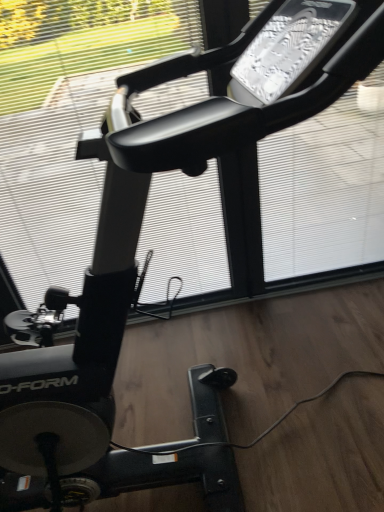
How much space does transparent plastic window screen at upper center, placed as the 1th window screen when sorted from right to left, occupy horizontally?

3.71 inches.

The image size is (384, 512). I want to click on transparent plastic window screen at upper center, which is the second window screen in left-to-right order, so click(x=325, y=187).

The width and height of the screenshot is (384, 512). What do you see at coordinates (325, 187) in the screenshot? I see `transparent plastic window screen at upper center, which is the second window screen in left-to-right order` at bounding box center [325, 187].

The height and width of the screenshot is (512, 384). What do you see at coordinates (66, 138) in the screenshot? I see `white matte window screen at center, acting as the second window screen starting from the right` at bounding box center [66, 138].

The width and height of the screenshot is (384, 512). Find the location of `white matte window screen at center, which ranks as the first window screen in left-to-right order`. white matte window screen at center, which ranks as the first window screen in left-to-right order is located at coordinates (66, 138).

This screenshot has height=512, width=384. What are the coordinates of `transparent plastic window screen at upper center, which is the second window screen in left-to-right order` in the screenshot? It's located at (325, 187).

Can you confirm if transparent plastic window screen at upper center, which is the second window screen in left-to-right order, is positioned to the left of white matte window screen at center, which ranks as the first window screen in left-to-right order?

No.

Does transparent plastic window screen at upper center, placed as the 1th window screen when sorted from right to left, lie behind white matte window screen at center, acting as the second window screen starting from the right?

Yes, transparent plastic window screen at upper center, placed as the 1th window screen when sorted from right to left, is further from the viewer.

Between point (303, 263) and point (61, 226), which one is positioned behind?

The point (303, 263) is farther.

From the image's perspective, is transparent plastic window screen at upper center, which is the second window screen in left-to-right order, beneath white matte window screen at center, acting as the second window screen starting from the right?

No, from the image's perspective, transparent plastic window screen at upper center, which is the second window screen in left-to-right order, is not below white matte window screen at center, acting as the second window screen starting from the right.

From a real-world perspective, is transparent plastic window screen at upper center, which is the second window screen in left-to-right order, physically located above or below white matte window screen at center, acting as the second window screen starting from the right?

From a real-world perspective, transparent plastic window screen at upper center, which is the second window screen in left-to-right order, is physically below white matte window screen at center, acting as the second window screen starting from the right.

Which object is thinner, transparent plastic window screen at upper center, placed as the 1th window screen when sorted from right to left, or white matte window screen at center, which ranks as the first window screen in left-to-right order?

With smaller width is white matte window screen at center, which ranks as the first window screen in left-to-right order.

From their relative heights in the image, would you say transparent plastic window screen at upper center, placed as the 1th window screen when sorted from right to left, is taller or shorter than white matte window screen at center, which ranks as the first window screen in left-to-right order?

transparent plastic window screen at upper center, placed as the 1th window screen when sorted from right to left, is shorter than white matte window screen at center, which ranks as the first window screen in left-to-right order.

Does transparent plastic window screen at upper center, placed as the 1th window screen when sorted from right to left, have a larger size compared to white matte window screen at center, acting as the second window screen starting from the right?

No.

Is transparent plastic window screen at upper center, which is the second window screen in left-to-right order, spatially inside white matte window screen at center, acting as the second window screen starting from the right, or outside of it?

transparent plastic window screen at upper center, which is the second window screen in left-to-right order, cannot be found inside white matte window screen at center, acting as the second window screen starting from the right.

Does transparent plastic window screen at upper center, which is the second window screen in left-to-right order, touch white matte window screen at center, which ranks as the first window screen in left-to-right order?

No, transparent plastic window screen at upper center, which is the second window screen in left-to-right order, is not next to white matte window screen at center, which ranks as the first window screen in left-to-right order.

Could you tell me if transparent plastic window screen at upper center, placed as the 1th window screen when sorted from right to left, is facing white matte window screen at center, acting as the second window screen starting from the right?

No, transparent plastic window screen at upper center, placed as the 1th window screen when sorted from right to left, does not turn towards white matte window screen at center, acting as the second window screen starting from the right.

What's the angular difference between transparent plastic window screen at upper center, placed as the 1th window screen when sorted from right to left, and white matte window screen at center, which ranks as the first window screen in left-to-right order,'s facing directions?

The angle between the facing direction of transparent plastic window screen at upper center, placed as the 1th window screen when sorted from right to left, and the facing direction of white matte window screen at center, which ranks as the first window screen in left-to-right order, is 0.00185 degrees.

Locate an element on the screen. The image size is (384, 512). window screen in front of the transparent plastic window screen at upper center, placed as the 1th window screen when sorted from right to left is located at coordinates (66, 138).

Is white matte window screen at center, acting as the second window screen starting from the right, at the right side of transparent plastic window screen at upper center, which is the second window screen in left-to-right order?

No.

Considering the relative positions of white matte window screen at center, which ranks as the first window screen in left-to-right order, and transparent plastic window screen at upper center, placed as the 1th window screen when sorted from right to left, in the image provided, is white matte window screen at center, which ranks as the first window screen in left-to-right order, in front of transparent plastic window screen at upper center, placed as the 1th window screen when sorted from right to left,?

Yes, white matte window screen at center, which ranks as the first window screen in left-to-right order, is in front of transparent plastic window screen at upper center, placed as the 1th window screen when sorted from right to left.

Is point (121, 59) more distant than point (375, 223)?

Yes, it is behind point (375, 223).

From the image's perspective, is white matte window screen at center, acting as the second window screen starting from the right, on transparent plastic window screen at upper center, placed as the 1th window screen when sorted from right to left?

Actually, white matte window screen at center, acting as the second window screen starting from the right, appears below transparent plastic window screen at upper center, placed as the 1th window screen when sorted from right to left, in the image.

Consider the image. From a real-world perspective, between white matte window screen at center, which ranks as the first window screen in left-to-right order, and transparent plastic window screen at upper center, which is the second window screen in left-to-right order, who is vertically lower?

transparent plastic window screen at upper center, which is the second window screen in left-to-right order, is physically lower.

From the picture: Considering the relative sizes of white matte window screen at center, acting as the second window screen starting from the right, and transparent plastic window screen at upper center, which is the second window screen in left-to-right order, in the image provided, is white matte window screen at center, acting as the second window screen starting from the right, thinner than transparent plastic window screen at upper center, which is the second window screen in left-to-right order,?

Yes, white matte window screen at center, acting as the second window screen starting from the right, is thinner than transparent plastic window screen at upper center, which is the second window screen in left-to-right order.

Based on the photo, in terms of height, does white matte window screen at center, which ranks as the first window screen in left-to-right order, look taller or shorter compared to transparent plastic window screen at upper center, placed as the 1th window screen when sorted from right to left?

Clearly, white matte window screen at center, which ranks as the first window screen in left-to-right order, is taller compared to transparent plastic window screen at upper center, placed as the 1th window screen when sorted from right to left.

Considering the sizes of objects white matte window screen at center, acting as the second window screen starting from the right, and transparent plastic window screen at upper center, which is the second window screen in left-to-right order, in the image provided, who is bigger, white matte window screen at center, acting as the second window screen starting from the right, or transparent plastic window screen at upper center, which is the second window screen in left-to-right order,?

Bigger between the two is white matte window screen at center, acting as the second window screen starting from the right.

Is transparent plastic window screen at upper center, placed as the 1th window screen when sorted from right to left, surrounded by white matte window screen at center, which ranks as the first window screen in left-to-right order?

No, transparent plastic window screen at upper center, placed as the 1th window screen when sorted from right to left, is located outside of white matte window screen at center, which ranks as the first window screen in left-to-right order.

Would you say white matte window screen at center, acting as the second window screen starting from the right, is a long distance from transparent plastic window screen at upper center, placed as the 1th window screen when sorted from right to left?

No, there isn't a large distance between white matte window screen at center, acting as the second window screen starting from the right, and transparent plastic window screen at upper center, placed as the 1th window screen when sorted from right to left.

Is white matte window screen at center, which ranks as the first window screen in left-to-right order, aimed at transparent plastic window screen at upper center, placed as the 1th window screen when sorted from right to left?

No.

This screenshot has height=512, width=384. In the image, there is a transparent plastic window screen at upper center, placed as the 1th window screen when sorted from right to left. Identify the location of window screen below it (from the image's perspective). (66, 138).

Locate an element on the screen. The image size is (384, 512). window screen behind the white matte window screen at center, which ranks as the first window screen in left-to-right order is located at coordinates [325, 187].

The height and width of the screenshot is (512, 384). What are the coordinates of `window screen that appears below the white matte window screen at center, which ranks as the first window screen in left-to-right order (from a real-world perspective)` in the screenshot? It's located at (325, 187).